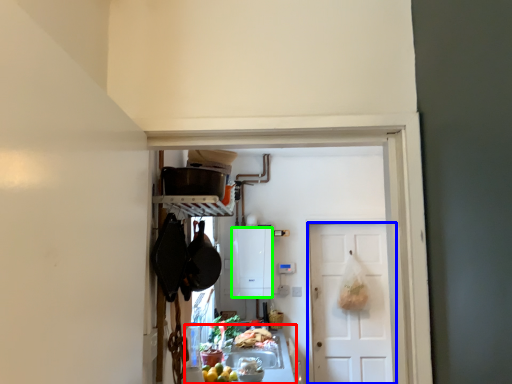
Question: Estimate the real-world distances between objects in this image. Which object is closer to counter top (highlighted by a red box), door (highlighted by a blue box) or cabinetry (highlighted by a green box)?

Choices:
 (A) door
 (B) cabinetry

Answer: (B)